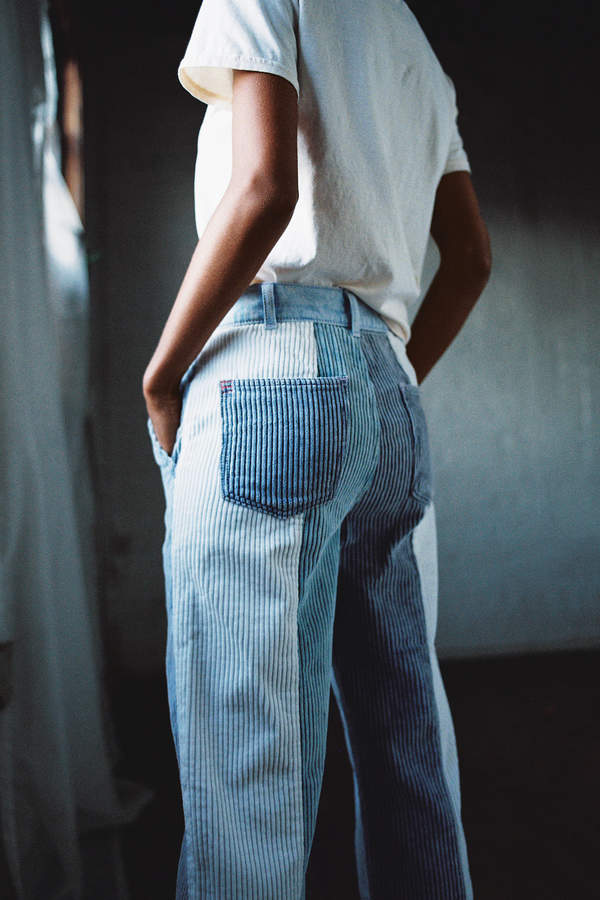
Find the location of a particular element. The height and width of the screenshot is (900, 600). floor is located at coordinates (522, 792).